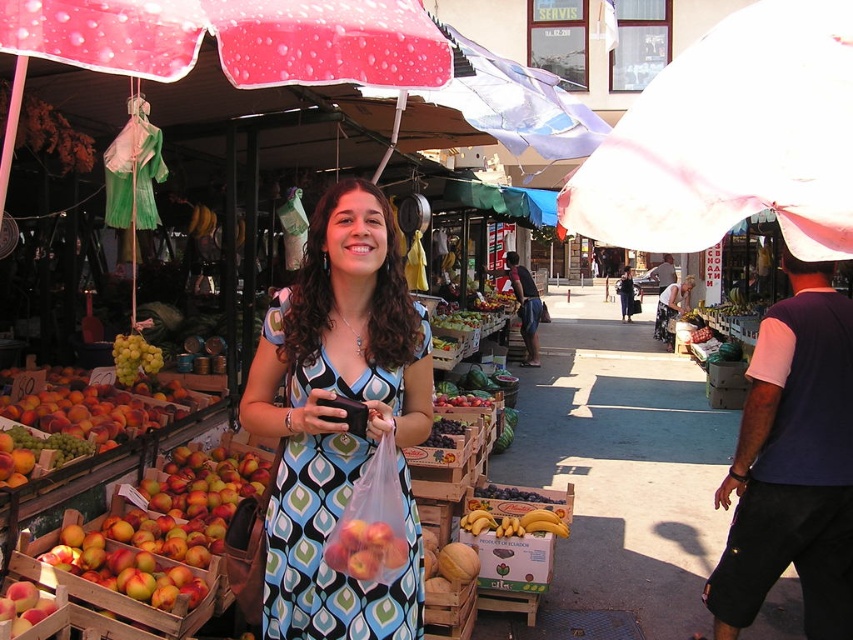
Does pink fabric umbrella at upper center have a greater height compared to pink fabric umbrella at upper right?

No.

The width and height of the screenshot is (853, 640). What do you see at coordinates (732, 140) in the screenshot?
I see `pink fabric umbrella at upper center` at bounding box center [732, 140].

At what (x,y) coordinates should I click in order to perform the action: click on pink fabric umbrella at upper center. Please return your answer as a coordinate pair (x, y). This screenshot has width=853, height=640. Looking at the image, I should click on (732, 140).

Is point (148, 570) positioned in front of point (114, 355)?

Yes, point (148, 570) is closer to viewer.

Who is shorter, shiny red apples at lower left or green matte grapes at left?

With less height is green matte grapes at left.

Identify the location of shiny red apples at lower left. Image resolution: width=853 pixels, height=640 pixels. (183, 528).

Is pink fabric umbrella at upper right wider than green matte grapes at left?

Yes.

From the picture: Is pink fabric umbrella at upper right closer to the viewer compared to green matte grapes at left?

That is True.

The height and width of the screenshot is (640, 853). What do you see at coordinates (792, 464) in the screenshot?
I see `pink fabric umbrella at upper right` at bounding box center [792, 464].

Where is `pink fabric umbrella at upper right`? This screenshot has height=640, width=853. pink fabric umbrella at upper right is located at coordinates (792, 464).